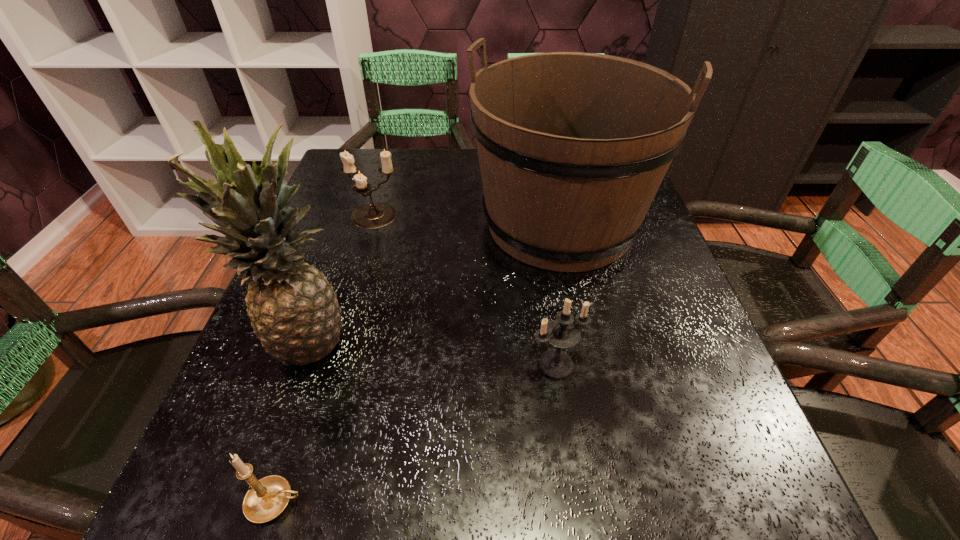
Identify the location of object situated at the far edge. (573, 147).

At what (x,y) coordinates should I click in order to perform the action: click on object at the near edge. Please return your answer as a coordinate pair (x, y). Image resolution: width=960 pixels, height=540 pixels. Looking at the image, I should click on (267, 498).

I want to click on pineapple situated at the left edge, so click(293, 309).

The height and width of the screenshot is (540, 960). Find the location of `object positioned at the right edge`. object positioned at the right edge is located at coordinates (573, 147).

Identify the location of object that is at the near left corner. The width and height of the screenshot is (960, 540). pos(267,498).

The height and width of the screenshot is (540, 960). I want to click on object that is at the far right corner, so tap(573, 147).

Locate an element on the screen. The height and width of the screenshot is (540, 960). free space at the far edge of the desktop is located at coordinates (438, 162).

The image size is (960, 540). In the image, there is a desktop. What are the coordinates of `vacant space at the near edge` in the screenshot? It's located at (602, 521).

Where is `free space at the left edge of the desktop`? This screenshot has width=960, height=540. free space at the left edge of the desktop is located at coordinates click(354, 270).

The height and width of the screenshot is (540, 960). In the image, there is a desktop. Identify the location of free region at the right edge. (658, 292).